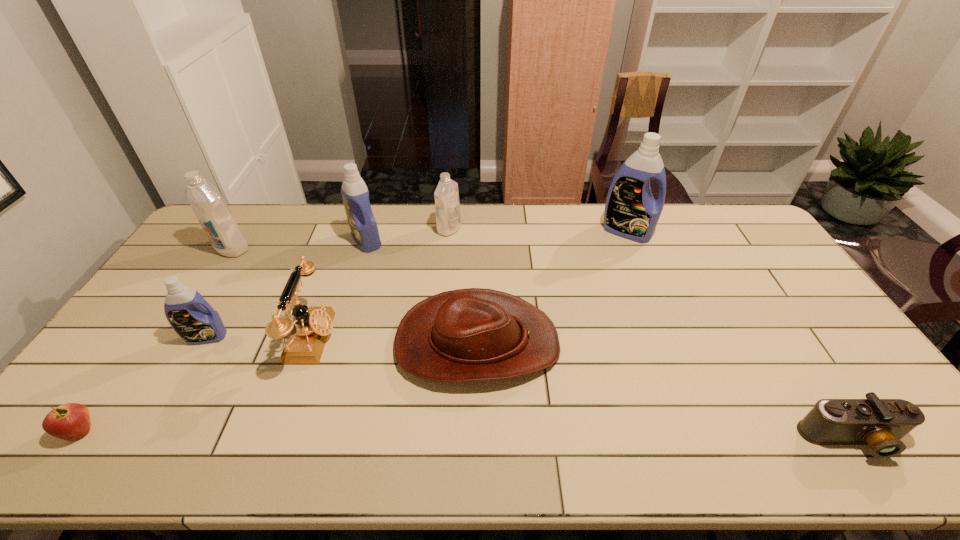
This screenshot has height=540, width=960. In the image, there is a desktop. Identify the location of vacant space at the near edge. [636, 443].

This screenshot has height=540, width=960. I want to click on vacant space at the left edge of the desktop, so click(205, 254).

The width and height of the screenshot is (960, 540). What are the coordinates of `vacant space at the right edge of the desktop` in the screenshot? It's located at (804, 333).

In the image, there is a desktop. Where is `vacant space at the far right corner`? This screenshot has height=540, width=960. vacant space at the far right corner is located at coordinates pyautogui.click(x=755, y=233).

Locate an element on the screen. free space between the eighth object from left to right and the nearest blue detergent is located at coordinates (417, 284).

The height and width of the screenshot is (540, 960). I want to click on free area in between the telephone and the apple, so click(197, 385).

Find the location of a particular element. The width and height of the screenshot is (960, 540). free space that is in between the smallest blue detergent and the smaller white detergent is located at coordinates (328, 283).

Image resolution: width=960 pixels, height=540 pixels. In order to click on empty location between the rightmost blue detergent and the telephone in this screenshot , I will do `click(469, 285)`.

Find the location of `vacant point located between the leftmost blue detergent and the cowboy hat`. vacant point located between the leftmost blue detergent and the cowboy hat is located at coordinates (342, 340).

The width and height of the screenshot is (960, 540). What are the coordinates of `unoccupied position between the nearest blue detergent and the beige telephone` in the screenshot? It's located at (260, 338).